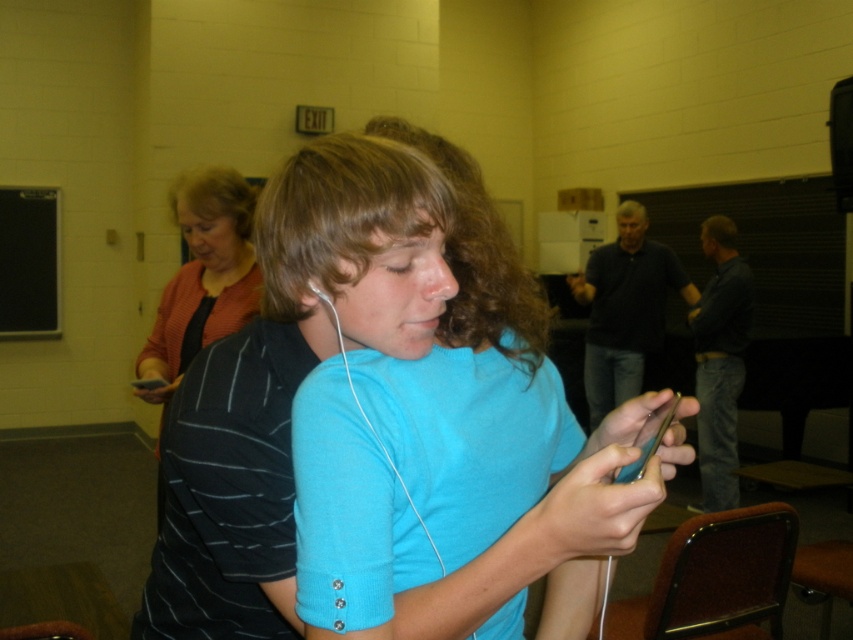
Between point (178, 182) and point (735, 230), which one is positioned behind?

Positioned behind is point (735, 230).

Is blonde hair at upper center closer to camera compared to dark brown curly hair at upper center?

That is True.

Which is in front, point (258, 188) or point (711, 216)?

Point (258, 188)

Where is `blonde hair at upper center`? The image size is (853, 640). blonde hair at upper center is located at coordinates (215, 196).

Is blonde hair at upper center shorter than brown curly hair at upper center?

Incorrect, blonde hair at upper center's height does not fall short of brown curly hair at upper center's.

Is blonde hair at upper center smaller than brown curly hair at upper center?

Actually, blonde hair at upper center might be larger than brown curly hair at upper center.

Who is more distant from viewer, (213, 168) or (646, 220)?

Positioned behind is point (646, 220).

Identify the location of blonde hair at upper center. The width and height of the screenshot is (853, 640). (215, 196).

How distant is dark blue sweater at center from brown curly hair at upper center?

dark blue sweater at center and brown curly hair at upper center are 60.94 centimeters apart from each other.

Who is taller, dark blue sweater at center or brown curly hair at upper center?

Standing taller between the two is dark blue sweater at center.

Which is in front, point (624, 317) or point (619, 208)?

Point (624, 317) is in front.

Image resolution: width=853 pixels, height=640 pixels. I want to click on dark blue sweater at center, so click(624, 312).